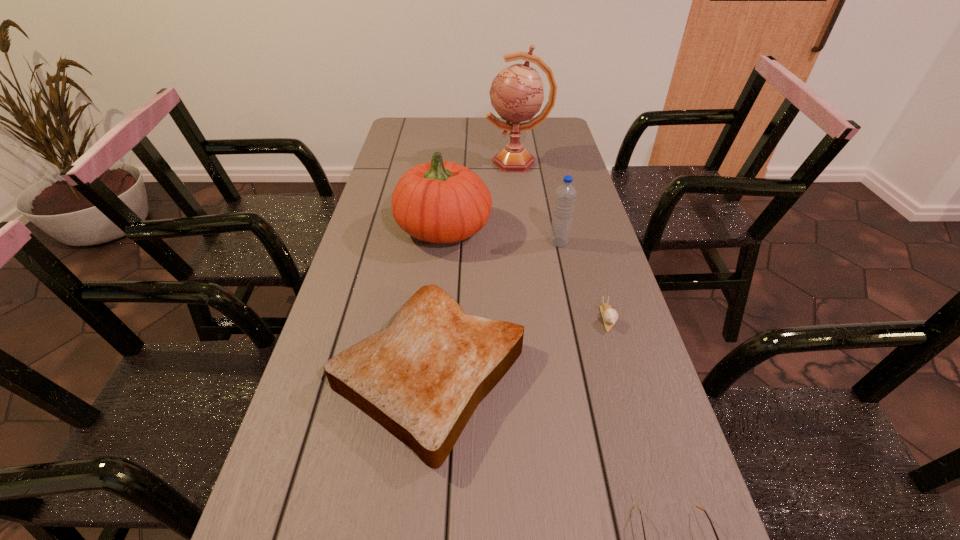
In the image, there is a desktop. Where is `free region at the right edge`? Image resolution: width=960 pixels, height=540 pixels. free region at the right edge is located at coordinates (691, 492).

In the image, there is a desktop. Identify the location of vacant space at the far left corner. This screenshot has width=960, height=540. (427, 125).

Locate an element on the screen. The height and width of the screenshot is (540, 960). vacant area between the third shortest object and the water bottle is located at coordinates (494, 307).

Where is `object that stands as the third closest to the water bottle`? The image size is (960, 540). object that stands as the third closest to the water bottle is located at coordinates (421, 378).

The width and height of the screenshot is (960, 540). In order to click on object that stands as the third closest to the sunglasses in this screenshot , I will do `click(439, 202)`.

Where is `vacant space that satisfies the following two spatial constraints: 1. on the front-facing side of the tallest object; 2. on the front side of the bread`? Image resolution: width=960 pixels, height=540 pixels. vacant space that satisfies the following two spatial constraints: 1. on the front-facing side of the tallest object; 2. on the front side of the bread is located at coordinates (544, 373).